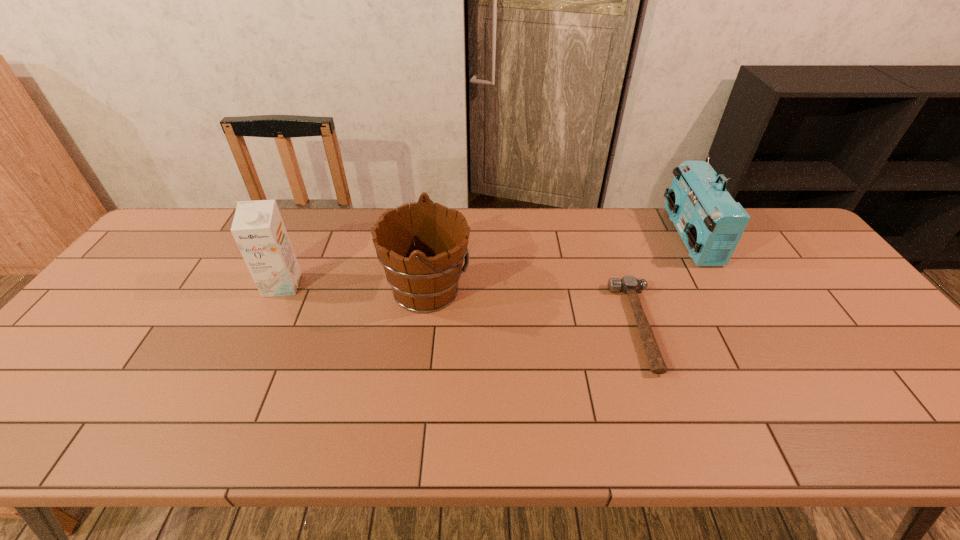
Locate an element on the screen. Image resolution: width=960 pixels, height=540 pixels. object that ranks as the third closest to the third object from left to right is located at coordinates (258, 229).

Locate an element on the screen. free space that satisfies the following two spatial constraints: 1. on the front-facing side of the radio receiver; 2. on the front side of the leftmost object is located at coordinates (717, 285).

You are a GUI agent. You are given a task and a screenshot of the screen. Output one action in this format:
    pyautogui.click(x=<x>, y=<y>)
    Task: Click on the vacant area in the image that satisfies the following two spatial constraints: 1. on the front-facing side of the rightmost object; 2. on the front side of the leftmost object
    
    Given the screenshot: What is the action you would take?
    pyautogui.click(x=717, y=285)